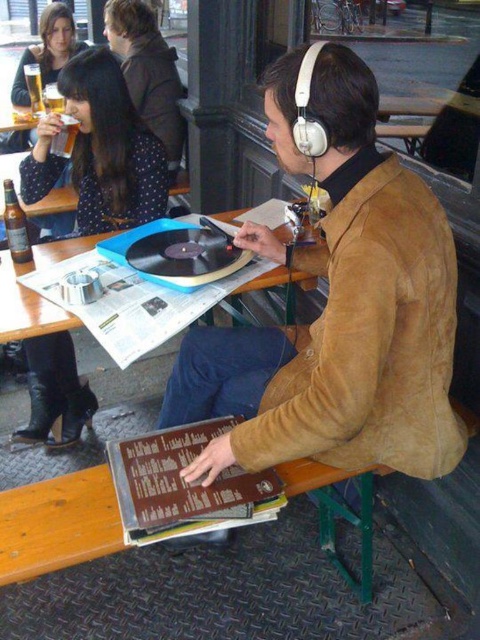
You are at a cafe and want to grab a drink. You see a brown glass bottle at left and a translucent glass beer at upper left. Which one is narrower?

The brown glass bottle at left has a lesser width compared to the translucent glass beer at upper left, so the brown glass bottle at left is narrower.

You are a photographer trying to capture a clear shot of the brown suede jacket at upper center without any obstructions. Given that the matte black dress at upper left is blocking your view, can you move around to the right side to get an unobstructed view?

The matte black dress at upper left is in front of the brown suede jacket at upper center, so moving to the right side may allow you to see around the dress and get an unobstructed view of the brown suede jacket at upper center.

You are a photographer standing at the back of the outdoor cafe. You want to take a photo of the matte black dress at upper left and the brown suede jacket at upper center without them overlapping in the frame. Given your camera has a 50mm lens, which has a field of view that can capture objects within 36 inches apart, can you capture both subjects in the same frame?

The distance between the matte black dress at upper left and brown suede jacket at upper center is 36.58 inches. Since the camera lens can only capture up to 36 inches, the two subjects are slightly too far apart to fit within the same frame without overlapping.